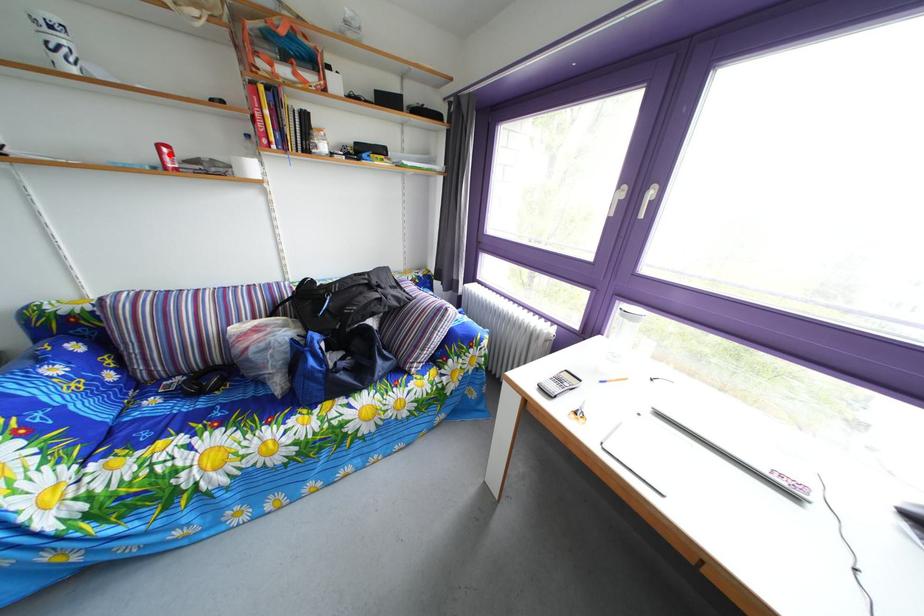
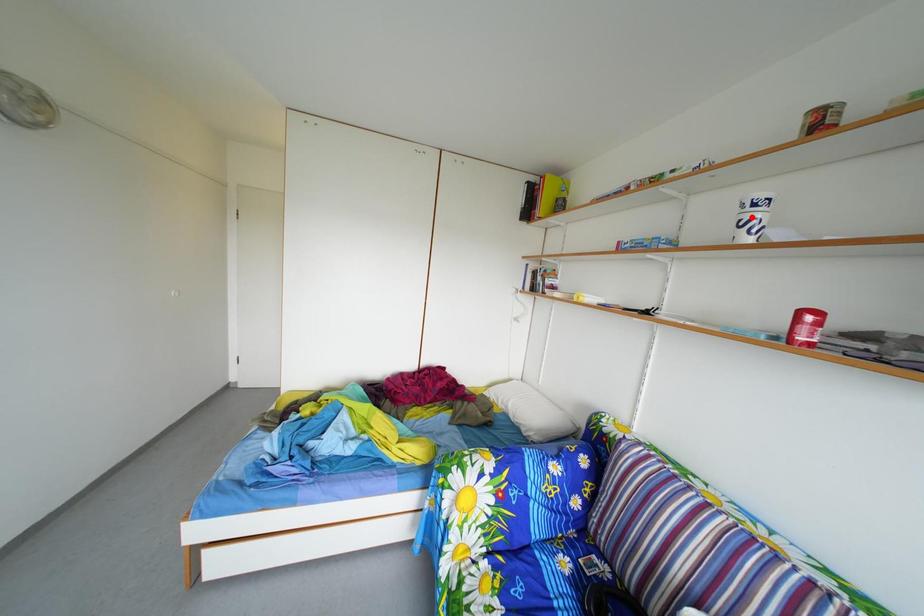
I am providing you with two images of the same scene from different viewpoints. A red point is marked on the first image and another point is marked on the second image. Does the point marked in image1 correspond to the same location as the one in image2?

No